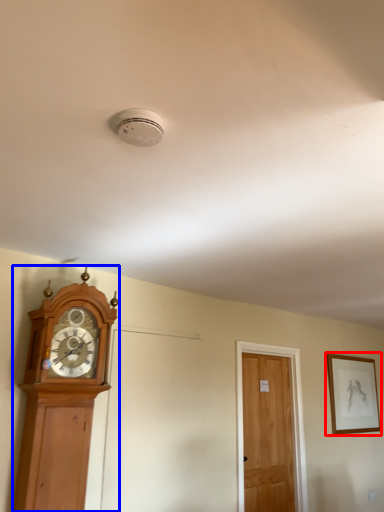
Question: Which object appears closest to the camera in this image, picture frame (highlighted by a red box) or wall clock (highlighted by a blue box)?

Choices:
 (A) picture frame
 (B) wall clock

Answer: (B)